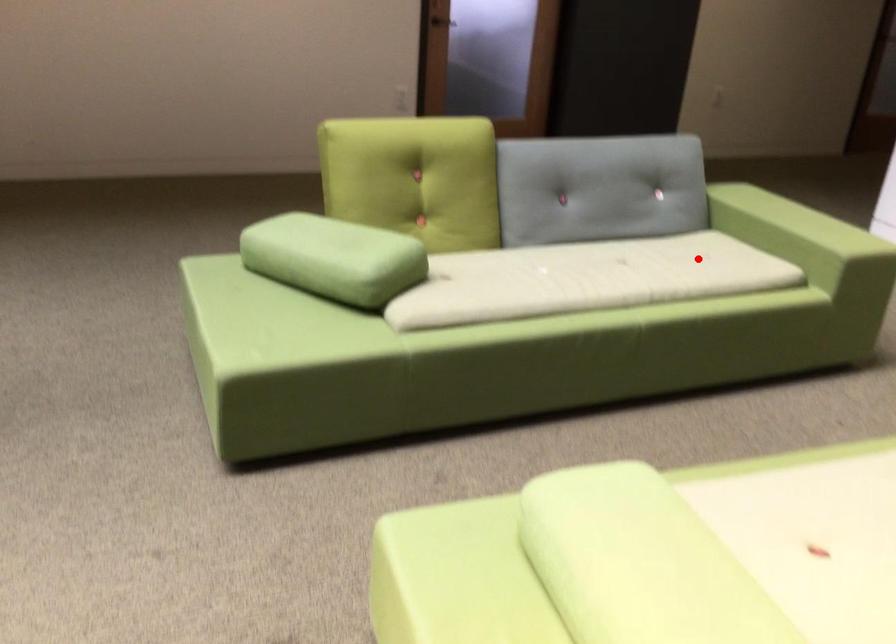
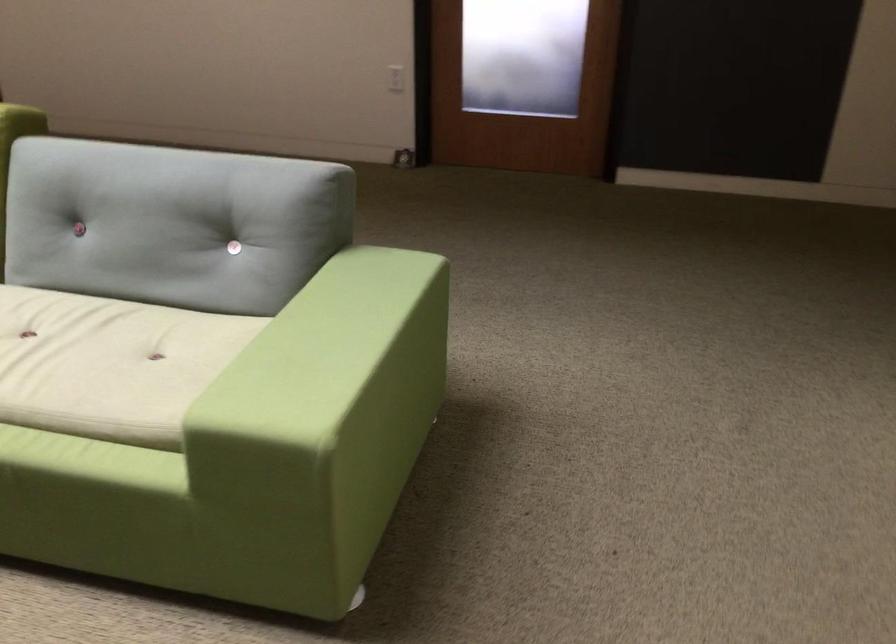
Question: I am providing you with two images of the same scene from different viewpoints. Image1 has a red point marked. In image2, the corresponding 3D location appears at what relative position? Reply with the corresponding letter.

Choices:
 (A) Closer
 (B) Farther

Answer: (A)